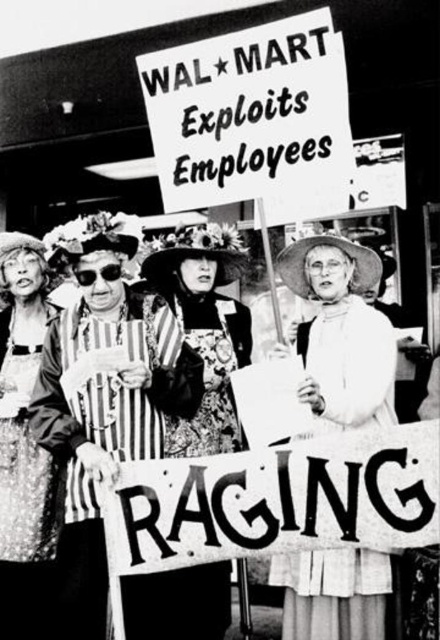
Question: In this image, where is striped fabric dress at center located relative to shiny sequined dress at left?

Choices:
 (A) below
 (B) above

Answer: (B)

Question: Can you confirm if striped fabric dress at center is positioned above patterned fabric dress at center?

Choices:
 (A) yes
 (B) no

Answer: (B)

Question: Which point appears closest to the camera in this image?

Choices:
 (A) (180, 392)
 (B) (18, 520)

Answer: (A)

Question: Which point is farther from the camera taking this photo?

Choices:
 (A) (172, 310)
 (B) (106, 266)
 (C) (123, 212)

Answer: (C)

Question: Is patterned fabric dress at center smaller than metallic reflective goggles at center?

Choices:
 (A) no
 (B) yes

Answer: (A)

Question: Which is farther from the metallic reflective goggles at center?

Choices:
 (A) white lace dress at center
 (B) shiny sequined dress at left
 (C) patterned fabric dress at center

Answer: (A)